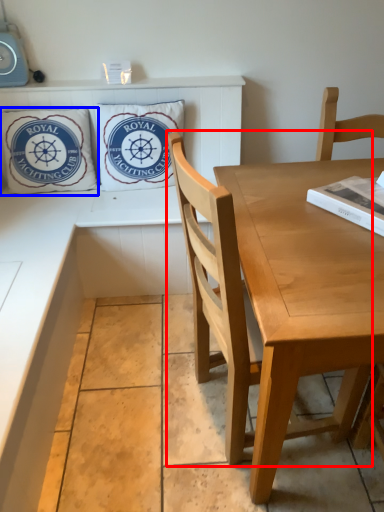
Question: Which object appears closest to the camera in this image, chair (highlighted by a red box) or pillow (highlighted by a blue box)?

Choices:
 (A) chair
 (B) pillow

Answer: (A)